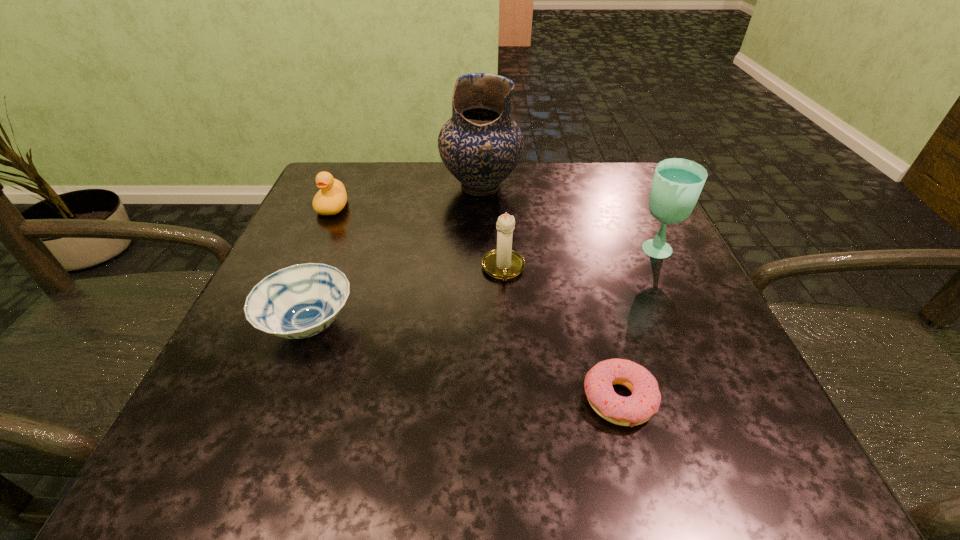
At what (x,y) coordinates should I click in order to perform the action: click on free spot between the second nearest object and the glass. Please return your answer as a coordinate pair (x, y). Looking at the image, I should click on (482, 289).

At what (x,y) coordinates should I click in order to perform the action: click on the second closest object to the second tallest object. Please return your answer as a coordinate pair (x, y). Looking at the image, I should click on (480, 145).

Point out which object is positioned as the second nearest to the tallest object. Please provide its 2D coordinates. Your answer should be formatted as a tuple, i.e. [(x, y)], where the tuple contains the x and y coordinates of a point satisfying the conditions above.

[(331, 198)]

Where is `blank space that satisfies the following two spatial constraints: 1. on the face of the rightmost object; 2. on the right side of the third shortest object`? The image size is (960, 540). blank space that satisfies the following two spatial constraints: 1. on the face of the rightmost object; 2. on the right side of the third shortest object is located at coordinates (313, 252).

The image size is (960, 540). Find the location of `vacant region that satisfies the following two spatial constraints: 1. on the face of the duck; 2. on the left side of the shortest object`. vacant region that satisfies the following two spatial constraints: 1. on the face of the duck; 2. on the left side of the shortest object is located at coordinates (247, 400).

You are a GUI agent. You are given a task and a screenshot of the screen. Output one action in this format:
    pyautogui.click(x=<x>, y=<y>)
    Task: Click on the vacant region that satisfies the following two spatial constraints: 1. on the face of the second nearest object; 2. on the left side of the fourth tallest object
    This screenshot has height=540, width=960.
    Given the screenshot: What is the action you would take?
    pyautogui.click(x=279, y=326)

Where is `free space that satisfies the following two spatial constraints: 1. on the back side of the doughnut; 2. on the left side of the rightmost object`? This screenshot has width=960, height=540. free space that satisfies the following two spatial constraints: 1. on the back side of the doughnut; 2. on the left side of the rightmost object is located at coordinates (579, 252).